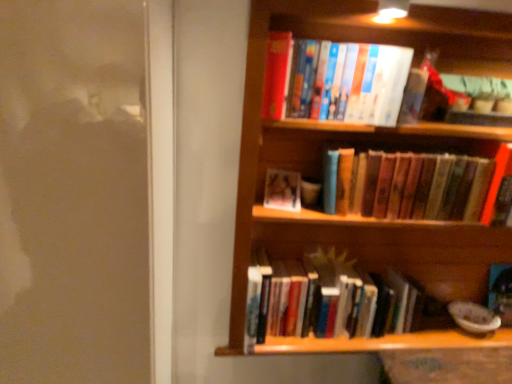
Question: Is hardcover books at center, acting as the second book starting from the top, taller or shorter than hardcover books at upper center, which is counted as the 1th book, starting from the top?

Choices:
 (A) tall
 (B) short

Answer: (B)

Question: Is hardcover books at center, which is counted as the third book, starting from the bottom, wider or thinner than hardcover books at upper center, the 4th book ordered from the bottom?

Choices:
 (A) wide
 (B) thin

Answer: (B)

Question: Which object is positioned closest to the matte plastic photo frame at center, the third book viewed from the top?

Choices:
 (A) hardcover books at lower center, positioned as the 1th book in bottom-to-top order
 (B) hardcover books at center, which is counted as the third book, starting from the bottom
 (C) hardcover books at upper center, which is counted as the 1th book, starting from the top
 (D) wooden bookshelf at upper right

Answer: (C)

Question: Which of these objects is positioned closest to the hardcover books at lower center, the 4th book positioned from the top?

Choices:
 (A) hardcover books at upper center, which is counted as the 1th book, starting from the top
 (B) wooden bookshelf at upper right
 (C) hardcover books at center, which is counted as the third book, starting from the bottom
 (D) matte plastic photo frame at center, acting as the second book starting from the bottom

Answer: (B)